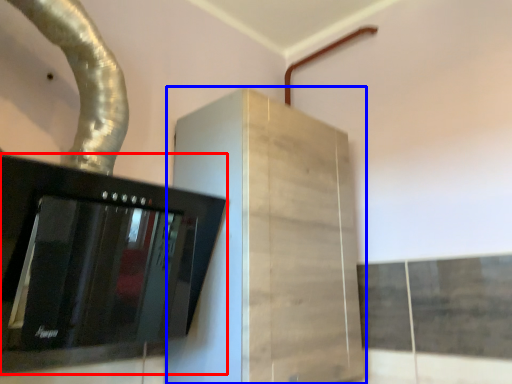
Question: Which object is closer to the camera taking this photo, home appliance (highlighted by a red box) or cabinetry (highlighted by a blue box)?

Choices:
 (A) home appliance
 (B) cabinetry

Answer: (A)